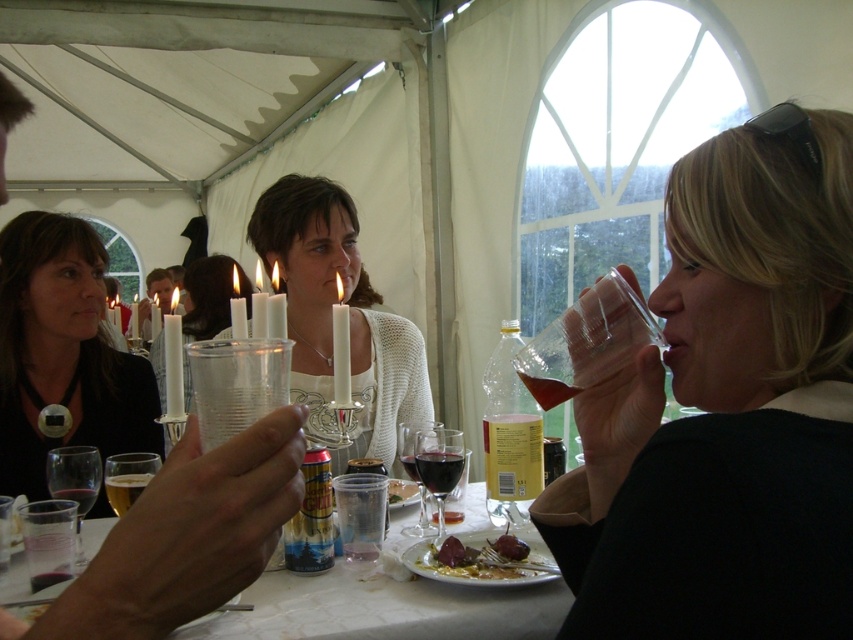
You are at an outdoor event and need to place a 60 cm long ribbon between the translucent plastic glass at upper right and the smooth plastic cup at center. Can the ribbon fit between them without bending?

The distance between the translucent plastic glass at upper right and the smooth plastic cup at center is 71.71 centimeters, which is longer than the 60 cm ribbon. Therefore, the ribbon can fit between them without bending.

You are at the event and want to place a small napkin under the translucent plastic glass at upper right. Can you put it there without moving the white plastic plate at lower center?

The white plastic plate at lower center is much taller than the translucent plastic glass at upper right, so placing a napkin under the glass would require moving the plate since the plate is taller and might block access to the glass.

You are at a party and need to choose a cup to hold a hot beverage. Which one between the translucent plastic glass at upper right and the smooth plastic cup at center would be more suitable?

The smooth plastic cup at center is more suitable for holding a hot beverage because it is thicker than the translucent plastic glass at upper right, which may not insulate as well.